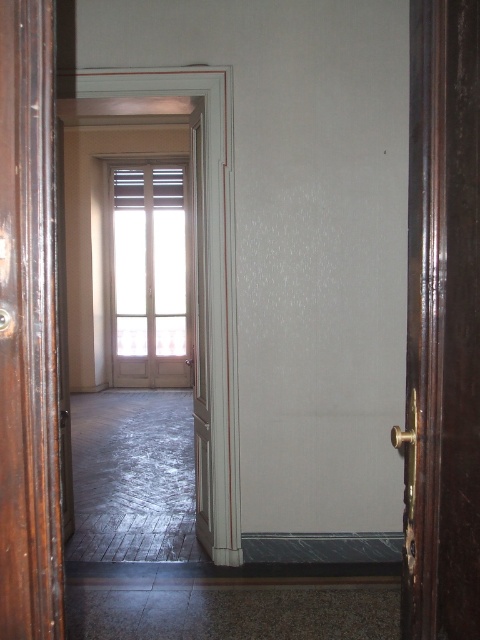
You are standing in the hallway and want to exit through the door that leads to the garden. The dark brown wooden door at left and the white wooden door at center are both in front of you. Which door should you choose to reach the garden?

The dark brown wooden door at left is in front of the white wooden door at center, so the dark brown wooden door at left is closer to you. Therefore, you should choose the dark brown wooden door at left to reach the garden.

You are standing in the hallway and want to exit through the door. Do you need to move past the white wood window at center to reach the dark brown wooden door at left?

The dark brown wooden door at left is in front of the white wood window at center, so you would need to move past the white wood window at center to reach the dark brown wooden door at left.